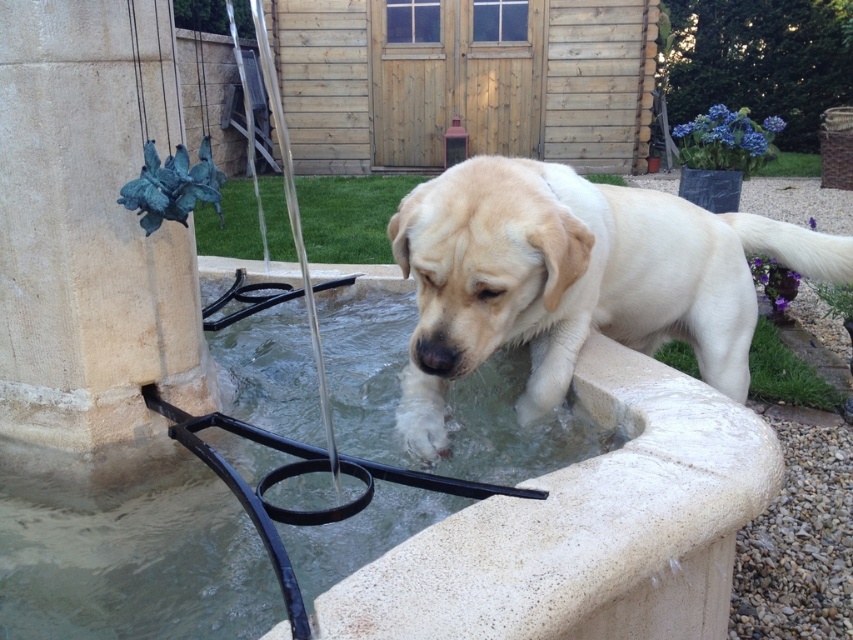
You are a photographer trying to capture the light beige fur at center and the green patina stone pillar at left in a single frame. Based on their positions, which object should you focus on first to ensure both are in the shot?

The green patina stone pillar at left is located above the light beige fur at center, so you should focus on the light beige fur at center first to ensure both are in the shot.

You are standing in the garden and want to place a small decoration between the two points, point (39, 548) and point (53, 81). Which point should the decoration be closer to in order to be closer to the viewer?

The decoration should be closer to point (39, 548) because it is closer to the viewer than point (53, 81).

You are a gardener who wants to place a new plant pot between the clear water at center and the green patina stone pillar at left. Based on their positions, where should you place the pot so it is closer to the pillar than the water?

The clear water at center is located below the green patina stone pillar at left. To place the pot closer to the pillar, position it between them but nearer to the pillar, ensuring it is above the water and below the pillar.